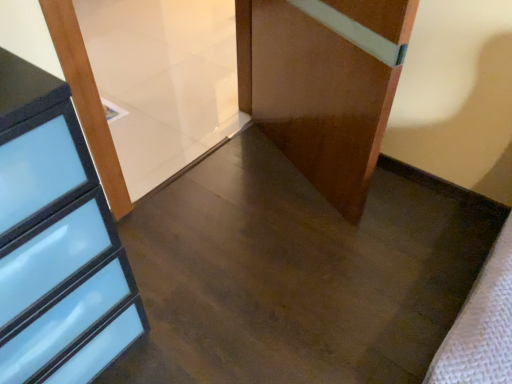
This screenshot has width=512, height=384. What are the coordinates of `brown matte door at center` in the screenshot? It's located at (324, 84).

This screenshot has height=384, width=512. Describe the element at coordinates (324, 84) in the screenshot. I see `brown matte door at center` at that location.

You are a GUI agent. You are given a task and a screenshot of the screen. Output one action in this format:
    pyautogui.click(x=<x>, y=<y>)
    Task: Click on the brown matte door at center
    The height and width of the screenshot is (384, 512).
    Given the screenshot: What is the action you would take?
    pyautogui.click(x=324, y=84)